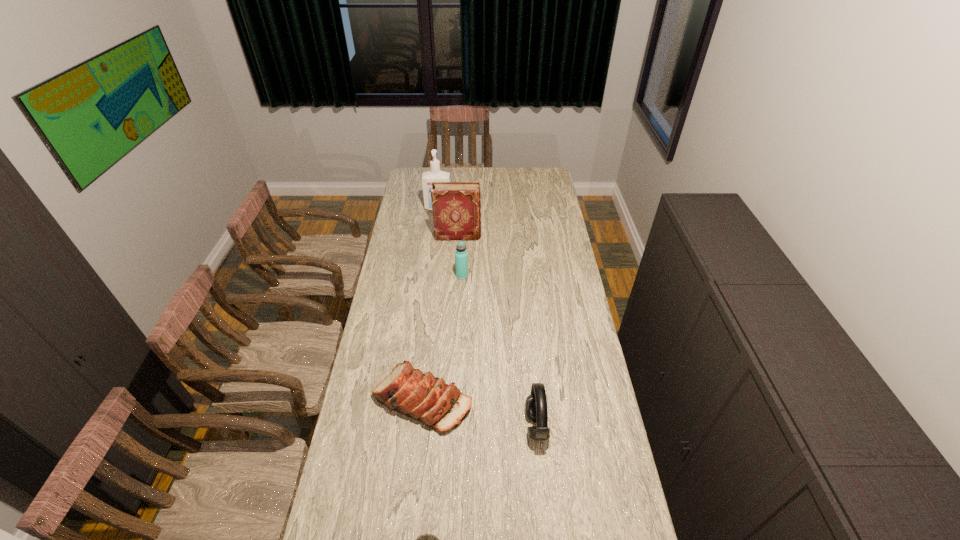
Locate an element on the screen. The width and height of the screenshot is (960, 540). free space between the fifth shortest object and the shortest object is located at coordinates (441, 318).

Locate an element on the screen. This screenshot has height=540, width=960. empty location between the shortest object and the rightmost object is located at coordinates (479, 413).

At what (x,y) coordinates should I click in order to perform the action: click on vacant area between the shortest object and the fifth shortest object. Please return your answer as a coordinate pair (x, y). Looking at the image, I should click on (441, 318).

What are the coordinates of `free space between the rightmost object and the cleansing agent` in the screenshot? It's located at (487, 318).

This screenshot has width=960, height=540. Identify the location of the closest object to the rightmost object. (428, 399).

Locate which object is the fourth closest to the cleansing agent. Please provide its 2D coordinates. Your answer should be formatted as a tuple, i.e. [(x, y)], where the tuple contains the x and y coordinates of a point satisfying the conditions above.

[(536, 403)]

You are a GUI agent. You are given a task and a screenshot of the screen. Output one action in this format:
    pyautogui.click(x=<x>, y=<y>)
    Task: Click on the free spot that satisfies the following two spatial constraints: 1. on the front label of the bread; 2. on the right side of the cleansing agent
    The width and height of the screenshot is (960, 540).
    Given the screenshot: What is the action you would take?
    pyautogui.click(x=415, y=400)

Where is `vacant space that satisfies the following two spatial constraints: 1. on the front label of the cleansing agent; 2. on the left side of the shortest object`? Image resolution: width=960 pixels, height=540 pixels. vacant space that satisfies the following two spatial constraints: 1. on the front label of the cleansing agent; 2. on the left side of the shortest object is located at coordinates (415, 400).

At what (x,y) coordinates should I click in order to perform the action: click on vacant space that satisfies the following two spatial constraints: 1. on the spine side of the fifth nearest object; 2. on the right side of the thermos bottle. Please return your answer as a coordinate pair (x, y). This screenshot has width=960, height=540. Looking at the image, I should click on (456, 275).

This screenshot has width=960, height=540. I want to click on free space that satisfies the following two spatial constraints: 1. on the back side of the third farthest object; 2. on the spine side of the hardback book, so (464, 236).